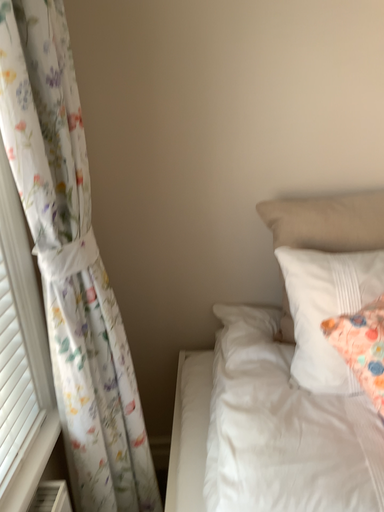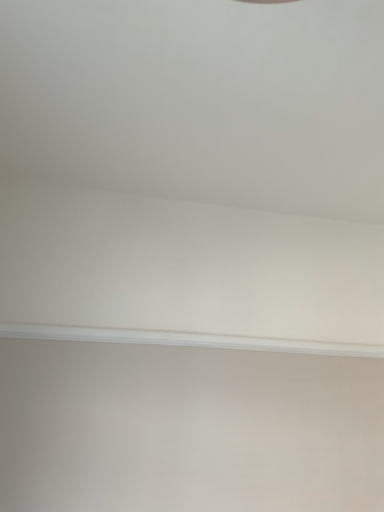
Question: How did the camera likely rotate when shooting the video?

Choices:
 (A) rotated right
 (B) rotated left

Answer: (A)